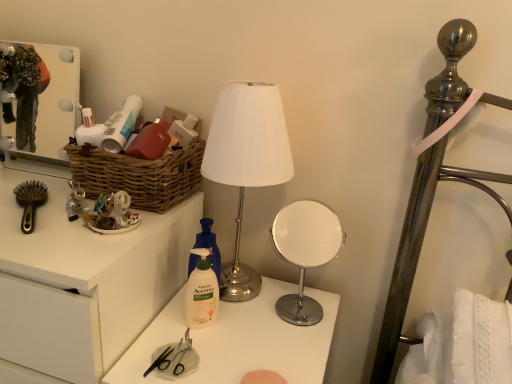
Question: Should I look upward or downward to see metallic silver scissors at center?

Choices:
 (A) up
 (B) down

Answer: (B)

Question: Is the position of metallic silver scissors at center more distant than that of matte plastic scissors at center?

Choices:
 (A) no
 (B) yes

Answer: (B)

Question: Is metallic silver scissors at center touching matte plastic scissors at center?

Choices:
 (A) yes
 (B) no

Answer: (B)

Question: Considering the relative sizes of metallic silver scissors at center and matte plastic scissors at center in the image provided, is metallic silver scissors at center wider than matte plastic scissors at center?

Choices:
 (A) yes
 (B) no

Answer: (B)

Question: Is metallic silver scissors at center to the right of matte plastic scissors at center from the viewer's perspective?

Choices:
 (A) no
 (B) yes

Answer: (A)

Question: Can you confirm if metallic silver scissors at center is shorter than matte plastic scissors at center?

Choices:
 (A) no
 (B) yes

Answer: (B)

Question: Considering the relative sizes of metallic silver scissors at center and matte plastic scissors at center in the image provided, is metallic silver scissors at center bigger than matte plastic scissors at center?

Choices:
 (A) yes
 (B) no

Answer: (B)

Question: Are brown woven basket at left and matte plastic scissors at center far apart?

Choices:
 (A) no
 (B) yes

Answer: (A)

Question: Does brown woven basket at left contain matte plastic scissors at center?

Choices:
 (A) yes
 (B) no

Answer: (B)

Question: Considering the relative sizes of brown woven basket at left and matte plastic scissors at center in the image provided, is brown woven basket at left smaller than matte plastic scissors at center?

Choices:
 (A) yes
 (B) no

Answer: (A)

Question: Can you confirm if brown woven basket at left is thinner than matte plastic scissors at center?

Choices:
 (A) no
 (B) yes

Answer: (B)

Question: From a real-world perspective, is brown woven basket at left below matte plastic scissors at center?

Choices:
 (A) yes
 (B) no

Answer: (B)

Question: From the image's perspective, is brown woven basket at left beneath matte plastic scissors at center?

Choices:
 (A) yes
 (B) no

Answer: (B)

Question: Does brown plastic brush at left lie in front of white glossy medicine cabinet at upper left?

Choices:
 (A) yes
 (B) no

Answer: (A)